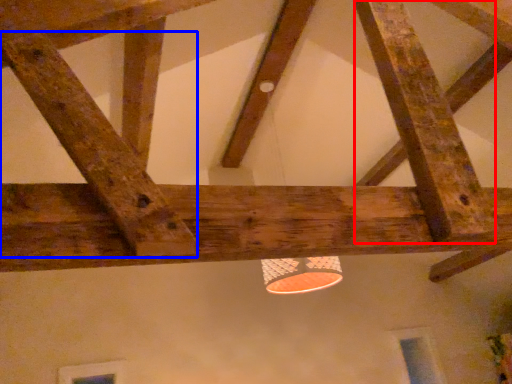
Question: Which object appears farthest to the camera in this image, plank (highlighted by a red box) or plank (highlighted by a blue box)?

Choices:
 (A) plank
 (B) plank

Answer: (A)